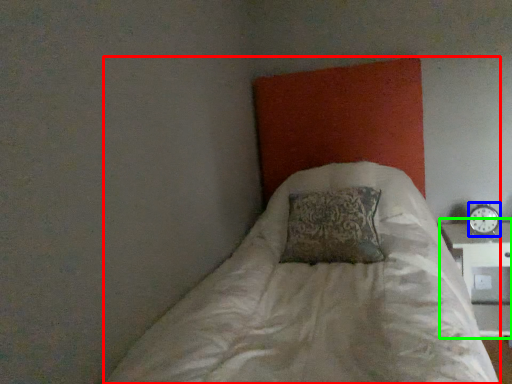
Question: Which is farther away from bed (highlighted by a red box)? clock (highlighted by a blue box) or table (highlighted by a green box)?

Choices:
 (A) clock
 (B) table

Answer: (A)